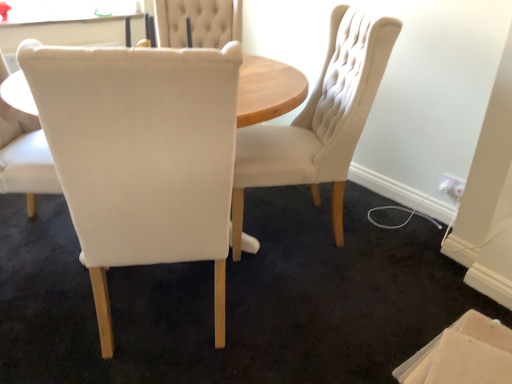
The height and width of the screenshot is (384, 512). Identify the location of vacant area situated below matte white chair at center, acting as the second chair starting from the left (from a real-world perspective). (162, 307).